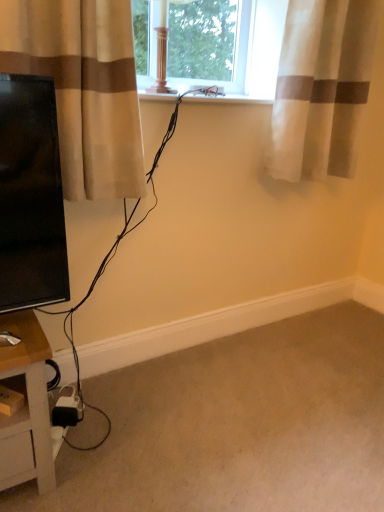
At what (x,y) coordinates should I click in order to perform the action: click on empty space that is ontop of beige carpet at lower right (from a real-world perspective). Please return your answer as a coordinate pair (x, y). Image resolution: width=384 pixels, height=512 pixels. Looking at the image, I should click on (201, 429).